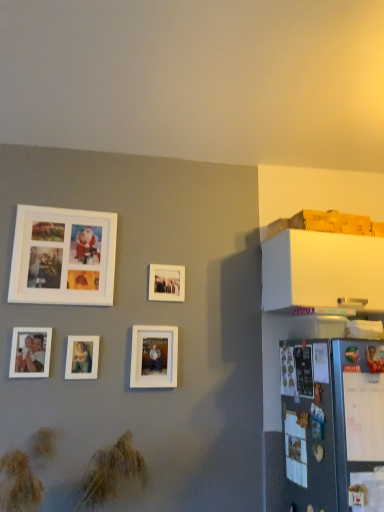
Question: Is white matte picture frame at upper left, which appears as the second picture frame when viewed from the left, not close to matte white picture frame at center, marked as the third picture frame in a right-to-left arrangement?

Choices:
 (A) no
 (B) yes

Answer: (A)

Question: Considering the relative sizes of white matte picture frame at upper left, arranged as the 4th picture frame when viewed from the right, and matte white picture frame at center, the third picture frame from the left, in the image provided, is white matte picture frame at upper left, arranged as the 4th picture frame when viewed from the right, shorter than matte white picture frame at center, the third picture frame from the left,?

Choices:
 (A) no
 (B) yes

Answer: (A)

Question: Can you confirm if white matte picture frame at upper left, arranged as the 4th picture frame when viewed from the right, is taller than matte white picture frame at center, marked as the third picture frame in a right-to-left arrangement?

Choices:
 (A) no
 (B) yes

Answer: (B)

Question: Is white matte picture frame at upper left, which appears as the second picture frame when viewed from the left, next to matte white picture frame at center, marked as the third picture frame in a right-to-left arrangement, and touching it?

Choices:
 (A) no
 (B) yes

Answer: (A)

Question: Would you say white matte picture frame at upper left, arranged as the 4th picture frame when viewed from the right, is outside matte white picture frame at center, the third picture frame from the left?

Choices:
 (A) no
 (B) yes

Answer: (B)

Question: From a real-world perspective, is white matte picture frame at center, which is counted as the 1th picture frame, starting from the right, above or below matte white picture frame at center, the third picture frame from the left?

Choices:
 (A) above
 (B) below

Answer: (A)

Question: In the image, is white matte picture frame at center, which is counted as the 1th picture frame, starting from the right, positioned in front of or behind matte white picture frame at center, the third picture frame from the left?

Choices:
 (A) front
 (B) behind

Answer: (B)

Question: Is white matte picture frame at center, acting as the 5th picture frame starting from the left, inside the boundaries of matte white picture frame at center, marked as the third picture frame in a right-to-left arrangement, or outside?

Choices:
 (A) outside
 (B) inside

Answer: (A)

Question: From the image's perspective, relative to matte white picture frame at center, the third picture frame from the left, is white matte picture frame at center, acting as the 5th picture frame starting from the left, above or below?

Choices:
 (A) above
 (B) below

Answer: (A)

Question: Based on their sizes in the image, would you say white matte picture frame at center, the fourth picture frame when ordered from left to right, is bigger or smaller than white matte picture frame at center, which is counted as the 1th picture frame, starting from the right?

Choices:
 (A) small
 (B) big

Answer: (B)

Question: Is white matte picture frame at center, placed as the 2th picture frame when sorted from right to left, to the left or to the right of white matte picture frame at center, which is counted as the 1th picture frame, starting from the right, in the image?

Choices:
 (A) left
 (B) right

Answer: (A)

Question: In terms of width, does white matte picture frame at center, placed as the 2th picture frame when sorted from right to left, look wider or thinner when compared to white matte picture frame at center, acting as the 5th picture frame starting from the left?

Choices:
 (A) thin
 (B) wide

Answer: (A)

Question: From the image's perspective, is white matte picture frame at center, the fourth picture frame when ordered from left to right, above or below white matte picture frame at center, which is counted as the 1th picture frame, starting from the right?

Choices:
 (A) below
 (B) above

Answer: (A)

Question: Is point (34, 214) closer or farther from the camera than point (94, 349)?

Choices:
 (A) closer
 (B) farther

Answer: (B)

Question: In terms of width, does white matte picture frame at upper left, arranged as the 4th picture frame when viewed from the right, look wider or thinner when compared to matte white picture frame at center, the third picture frame from the left?

Choices:
 (A) thin
 (B) wide

Answer: (B)